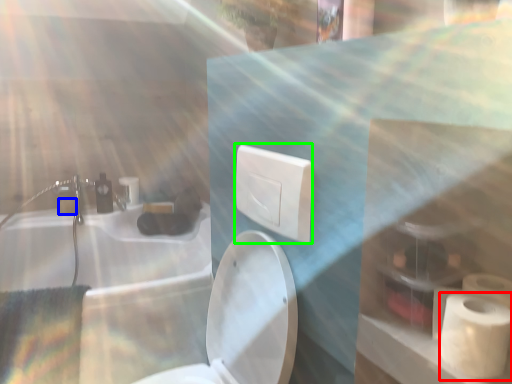
Question: Which object is the closest to the toiletry bag (highlighted by a red box)? Choose among these: toilet paper (highlighted by a blue box) or electric outlet (highlighted by a green box).

Choices:
 (A) toilet paper
 (B) electric outlet

Answer: (B)